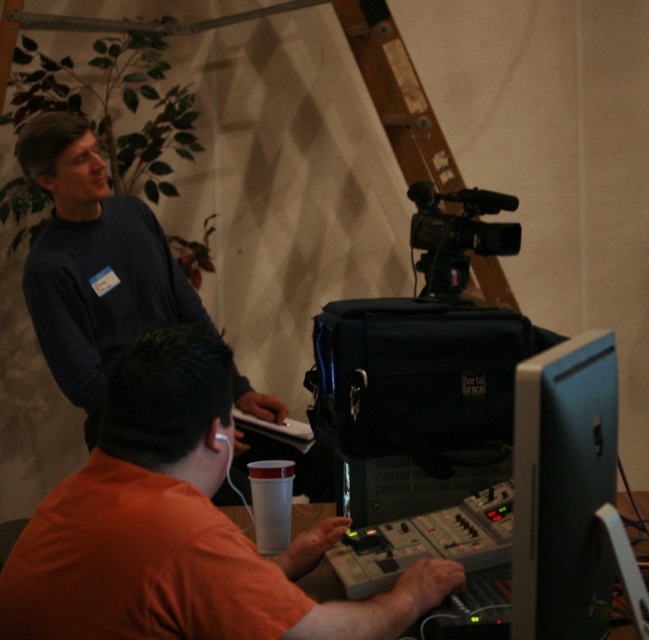
You are standing in the room and want to take a photo of both the point at coordinates [103,220] and the point at coordinates [545,433]. Which point should you focus on first to ensure both are in focus?

You should focus on the point at coordinates [103,220] first because it is closer to the camera than the point at coordinates [545,433]. This way, adjusting focus from near to far will help both points be in focus.

You are organizing a small event and need to set up a presentation. You have an orange cotton shirt at center and a matte black monitor at lower right. Based on the scene description, which object is located to the left of the other?

The orange cotton shirt at center is positioned on the left side of matte black monitor at lower right.